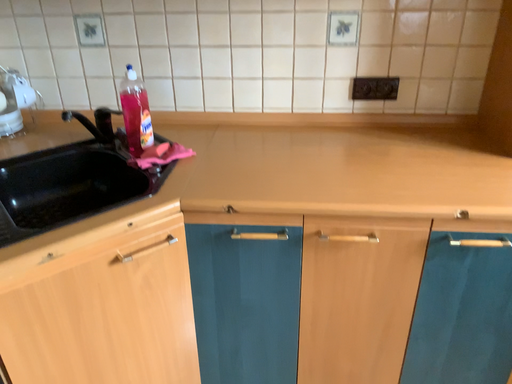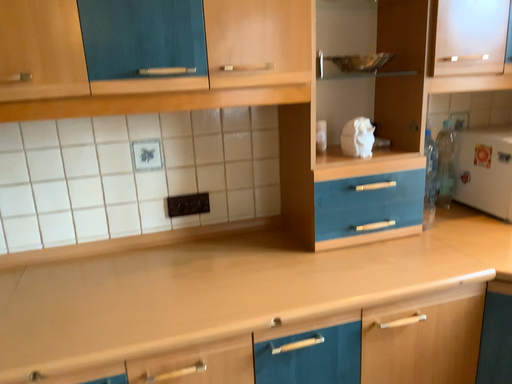
Question: How did the camera likely rotate when shooting the video?

Choices:
 (A) rotated downward
 (B) rotated upward

Answer: (B)